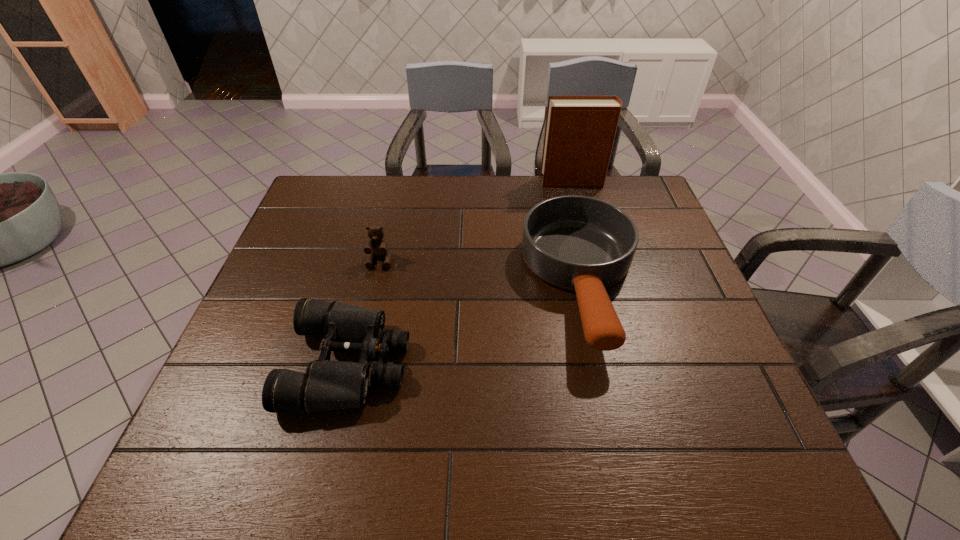
Identify the location of free space that satisfies the following two spatial constraints: 1. on the handle side of the pan; 2. through the eyepieces of the binoculars. This screenshot has width=960, height=540. (599, 363).

Where is `free space that satisfies the following two spatial constraints: 1. on the open cover of the farthest object; 2. on the handle side of the pan`? free space that satisfies the following two spatial constraints: 1. on the open cover of the farthest object; 2. on the handle side of the pan is located at coordinates (600, 284).

I want to click on free space in the image that satisfies the following two spatial constraints: 1. on the open cover of the farthest object; 2. on the handle side of the pan, so click(600, 284).

At what (x,y) coordinates should I click in order to perform the action: click on vacant region that satisfies the following two spatial constraints: 1. on the open cover of the farthest object; 2. on the face of the teddy bear. Please return your answer as a coordinate pair (x, y). The height and width of the screenshot is (540, 960). Looking at the image, I should click on (593, 261).

Where is `free space that satisfies the following two spatial constraints: 1. on the face of the teddy bear; 2. through the eyepieces of the binoculars`? This screenshot has height=540, width=960. free space that satisfies the following two spatial constraints: 1. on the face of the teddy bear; 2. through the eyepieces of the binoculars is located at coordinates click(x=356, y=363).

You are a GUI agent. You are given a task and a screenshot of the screen. Output one action in this format:
    pyautogui.click(x=<x>, y=<y>)
    Task: Click on the free space that satisfies the following two spatial constraints: 1. on the open cover of the hardback book; 2. on the handle side of the pan
    The height and width of the screenshot is (540, 960).
    Given the screenshot: What is the action you would take?
    pyautogui.click(x=600, y=284)

The width and height of the screenshot is (960, 540). In order to click on free region that satisfies the following two spatial constraints: 1. on the open cover of the tallest object; 2. on the handle side of the pan in this screenshot , I will do `click(600, 284)`.

Find the location of a particular element. This screenshot has width=960, height=540. vacant region that satisfies the following two spatial constraints: 1. on the open cover of the farthest object; 2. on the handle side of the pan is located at coordinates (600, 284).